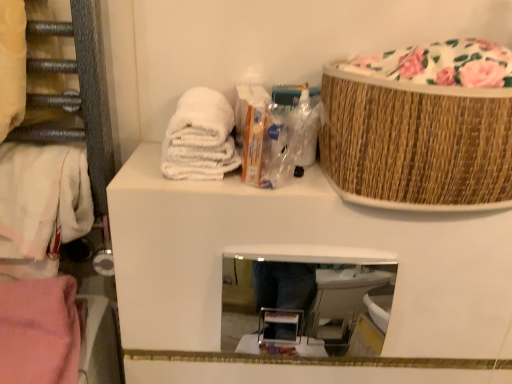
Question: Should I look upward or downward to see pink fabric towel at lower left, the first material when ordered from left to right?

Choices:
 (A) up
 (B) down

Answer: (B)

Question: From a real-world perspective, is white towel at upper left, the 2th material when ordered from bottom to top, beneath floral fabric basket at upper right?

Choices:
 (A) yes
 (B) no

Answer: (A)

Question: Does white towel at upper left, marked as the 2th material in a left-to-right arrangement, have a greater height compared to floral fabric basket at upper right?

Choices:
 (A) no
 (B) yes

Answer: (B)

Question: Does white towel at upper left, which is counted as the 1th material, starting from the top, contain floral fabric basket at upper right?

Choices:
 (A) yes
 (B) no

Answer: (B)

Question: Could you tell me if white towel at upper left, marked as the 2th material in a left-to-right arrangement, is turned towards floral fabric basket at upper right?

Choices:
 (A) yes
 (B) no

Answer: (B)

Question: Is white towel at upper left, the 2th material when ordered from bottom to top, closer to camera compared to floral fabric basket at upper right?

Choices:
 (A) yes
 (B) no

Answer: (B)

Question: Is the surface of white towel at upper left, which is counted as the 1th material, starting from the top, in direct contact with floral fabric basket at upper right?

Choices:
 (A) yes
 (B) no

Answer: (B)

Question: Is pink fabric towel at lower left, the first material when ordered from left to right, far from floral fabric basket at upper right?

Choices:
 (A) no
 (B) yes

Answer: (A)

Question: Is pink fabric towel at lower left, the first material when ordered from left to right, outside of floral fabric basket at upper right?

Choices:
 (A) no
 (B) yes

Answer: (B)

Question: Does pink fabric towel at lower left, arranged as the 1th material when ordered from the bottom, appear on the left side of floral fabric basket at upper right?

Choices:
 (A) no
 (B) yes

Answer: (B)

Question: Considering the relative sizes of pink fabric towel at lower left, the first material when ordered from left to right, and floral fabric basket at upper right in the image provided, is pink fabric towel at lower left, the first material when ordered from left to right, wider than floral fabric basket at upper right?

Choices:
 (A) yes
 (B) no

Answer: (B)

Question: From the image's perspective, is pink fabric towel at lower left, positioned as the 2th material in right-to-left order, above floral fabric basket at upper right?

Choices:
 (A) no
 (B) yes

Answer: (A)

Question: Is pink fabric towel at lower left, the first material when ordered from left to right, at the right side of floral fabric basket at upper right?

Choices:
 (A) no
 (B) yes

Answer: (A)

Question: From a real-world perspective, is bamboo textured basket at upper right positioned over white cotton towel at left based on gravity?

Choices:
 (A) yes
 (B) no

Answer: (A)